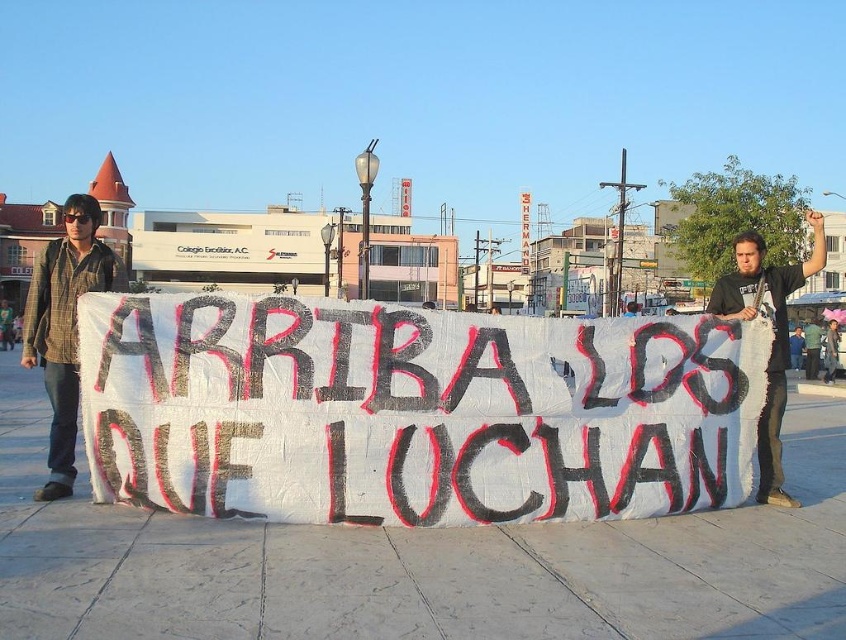
You are a photographer trying to capture a photo of the protest scene. You want to ensure both the plaid shirt at left and the green fabric shirt at center are visible in the frame. Based on their positions, which side of the frame should you focus on to include both?

You should focus on the left side of the frame to include both the plaid shirt at left and the green fabric shirt at center since the plaid shirt at left is positioned to the left of the green fabric shirt at center, meaning they are aligned horizontally from left to right.